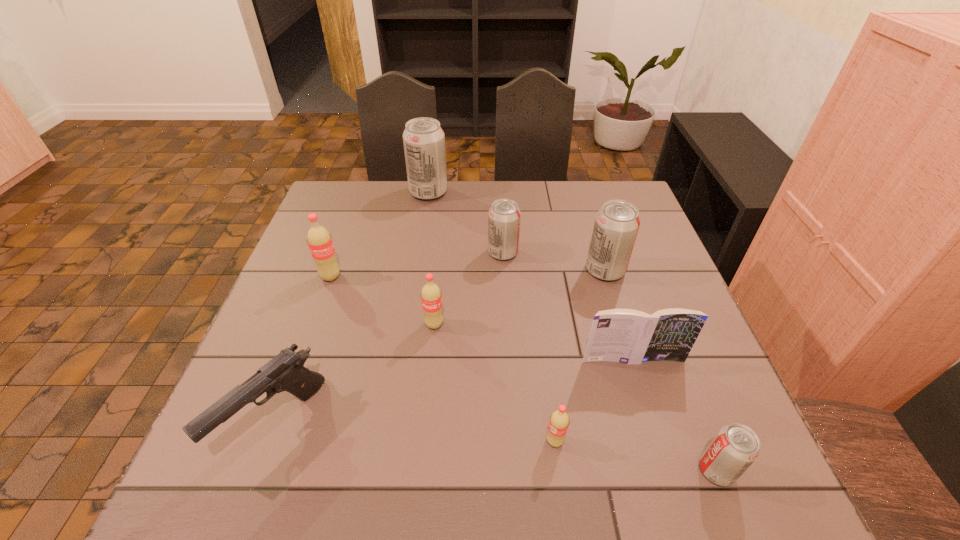
This screenshot has width=960, height=540. I want to click on vacant space positioned 0.330m on the right of the second smallest red soda, so click(x=585, y=325).

Identify the location of free space located on the front cover of the sixth farthest object. This screenshot has width=960, height=540. (675, 495).

Where is `vacant space located 0.120m on the right of the sixth farthest soda can`? The height and width of the screenshot is (540, 960). vacant space located 0.120m on the right of the sixth farthest soda can is located at coordinates (628, 441).

In order to click on vacant space located 0.370m on the back of the smallest gray soda can in this screenshot , I will do `click(653, 306)`.

Where is `object located at the far edge`? This screenshot has width=960, height=540. object located at the far edge is located at coordinates (423, 138).

In order to click on gun located at the near edge in this screenshot , I will do `click(285, 372)`.

The image size is (960, 540). I want to click on soda can present at the near edge, so click(x=735, y=447).

In order to click on soda present at the left edge in this screenshot , I will do `click(319, 240)`.

I want to click on gun that is positioned at the left edge, so [285, 372].

Identify the location of book present at the right edge. The width and height of the screenshot is (960, 540). (629, 336).